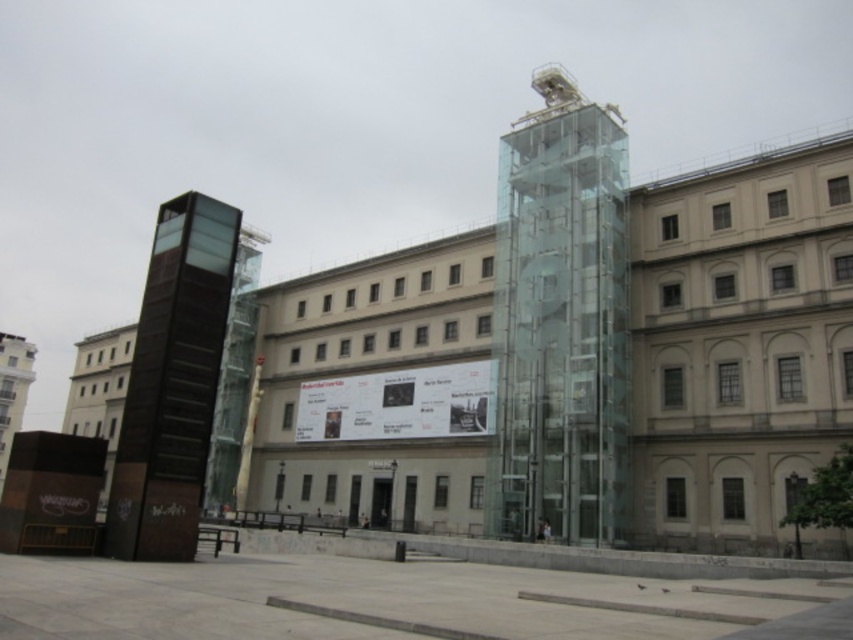
You are an urban planner evaluating the space between two towers in the public square. The transparent glass tower at center and the dark brown polished stone tower at left are both part of your study. Based on their widths, which tower would require more horizontal space to accommodate its base?

The transparent glass tower at center requires more horizontal space because its width is larger than the dark brown polished stone tower at left.

You are standing at the entrance of the public square and want to locate the transparent glass tower at center. According to the coordinates provided, where should you look relative to your position?

The transparent glass tower at center is located at coordinates point (x=561, y=321), which means it is positioned slightly to the right and lower center of the square from your perspective.